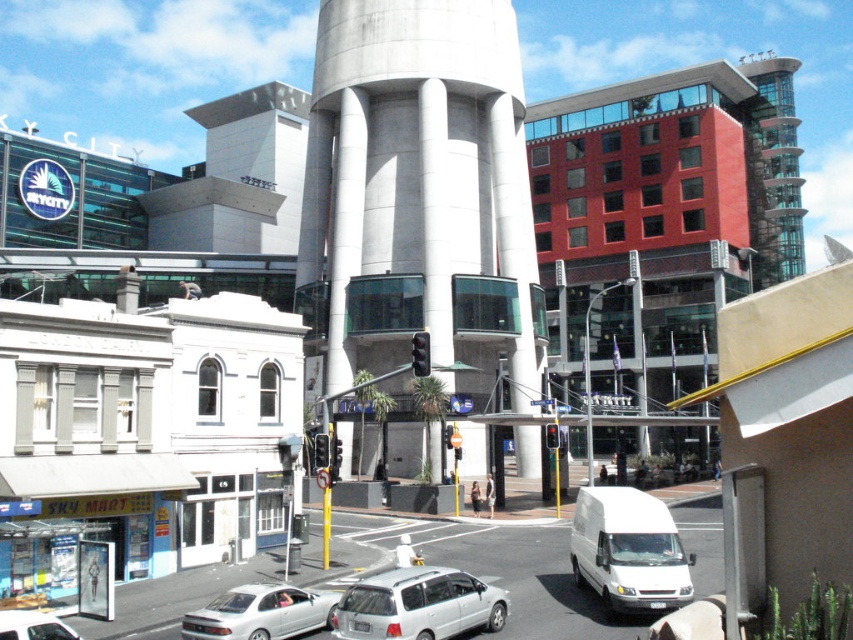
Question: In this image, where is white matte van at lower right located relative to silver metallic sedan at lower center?

Choices:
 (A) right
 (B) left

Answer: (A)

Question: Which of the following is the closest to the observer?

Choices:
 (A) silver metallic sedan at lower left
 (B) concrete water tower at center
 (C) silver metallic van at center
 (D) white matte van at lower right

Answer: (A)

Question: Which object appears farthest from the camera in this image?

Choices:
 (A) silver metallic sedan at lower left
 (B) silver metallic van at center
 (C) concrete water tower at center
 (D) silver metallic sedan at lower center

Answer: (C)

Question: Which object is farther from the camera taking this photo?

Choices:
 (A) white matte van at lower right
 (B) concrete water tower at center
 (C) silver metallic sedan at lower left

Answer: (B)

Question: Is concrete water tower at center to the left of white matte van at lower right from the viewer's perspective?

Choices:
 (A) no
 (B) yes

Answer: (B)

Question: Does concrete water tower at center have a smaller size compared to silver metallic van at center?

Choices:
 (A) no
 (B) yes

Answer: (A)